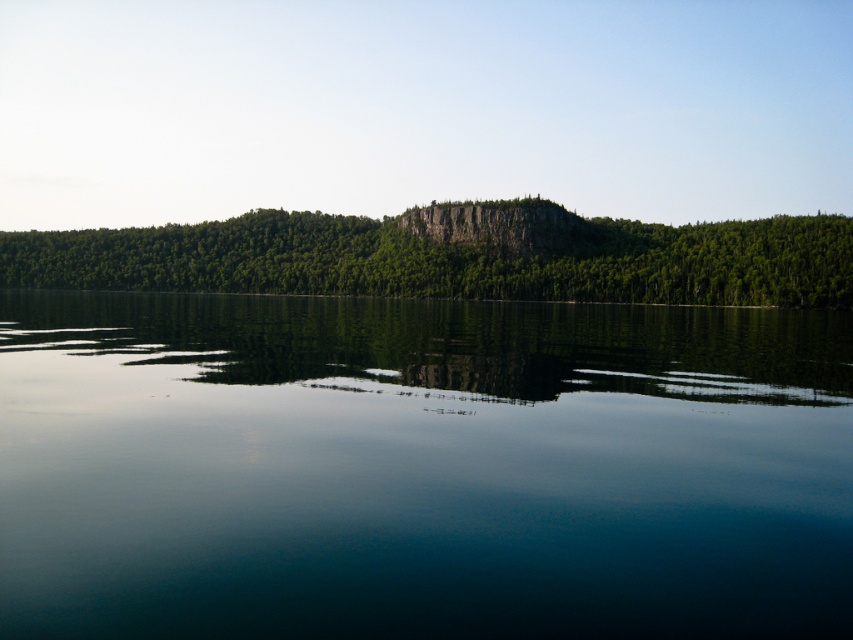
You are standing at the point marked as point [421,468] in the image. What object is directly beneath your feet?

The transparent glass water at center is directly beneath point [421,468].

You are standing at the edge of the serene natural landscape and want to take a photo of both the transparent glass water at center and the rocky cliff at center. Which object will appear larger in your photo?

The transparent glass water at center will appear larger in the photo because it is closer to the viewer than the rocky cliff at center.